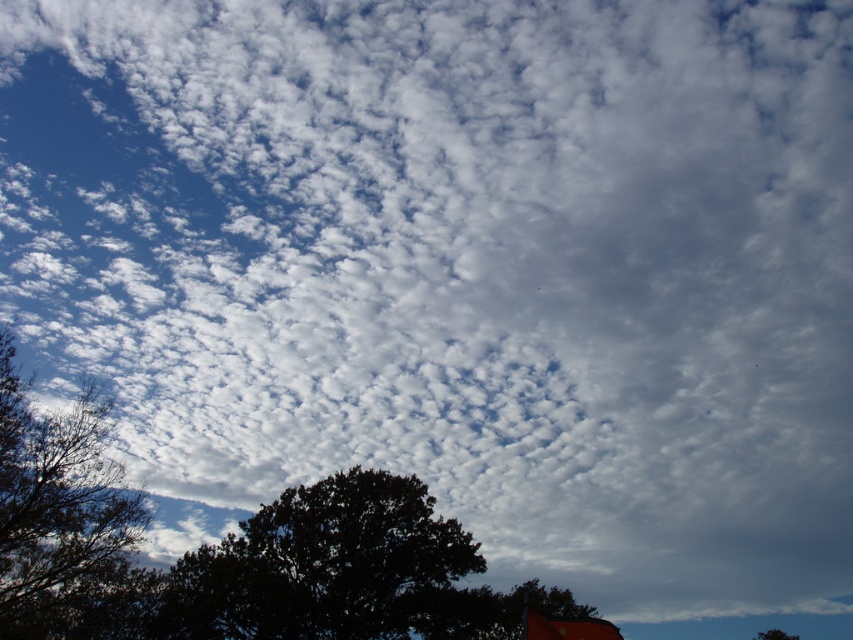
Who is positioned more to the left, dark green leafy tree at left or orange fabric flag at lower right?

dark green leafy tree at left

Does point (16, 532) lie behind point (525, 611)?

That is True.

The image size is (853, 640). I want to click on dark green leafy tree at left, so click(64, 518).

Is orange fabric flag at lower right shorter than dark green leafy tree at bottom?

Correct, orange fabric flag at lower right is not as tall as dark green leafy tree at bottom.

Which is in front, point (587, 621) or point (770, 632)?

Positioned in front is point (587, 621).

Find the location of a particular element. The width and height of the screenshot is (853, 640). orange fabric flag at lower right is located at coordinates (566, 627).

Does dark green leafy tree at left have a lesser width compared to dark green leafy tree at bottom?

No, dark green leafy tree at left is not thinner than dark green leafy tree at bottom.

This screenshot has width=853, height=640. In order to click on dark green leafy tree at left in this screenshot , I will do `click(64, 518)`.

Where is `dark green leafy tree at left`? This screenshot has width=853, height=640. dark green leafy tree at left is located at coordinates (64, 518).